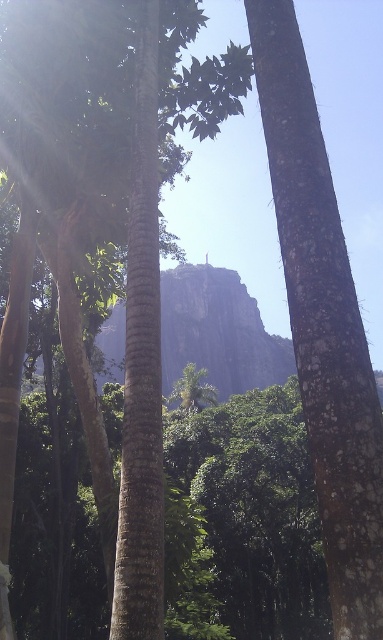
Can you confirm if rugged stone mountain at center is bigger than green leafy palm tree at center?

Correct, rugged stone mountain at center is larger in size than green leafy palm tree at center.

Does point (268, 384) lie in front of point (176, 388)?

No, (268, 384) is further to viewer.

Where is `rugged stone mountain at center`? rugged stone mountain at center is located at coordinates (217, 332).